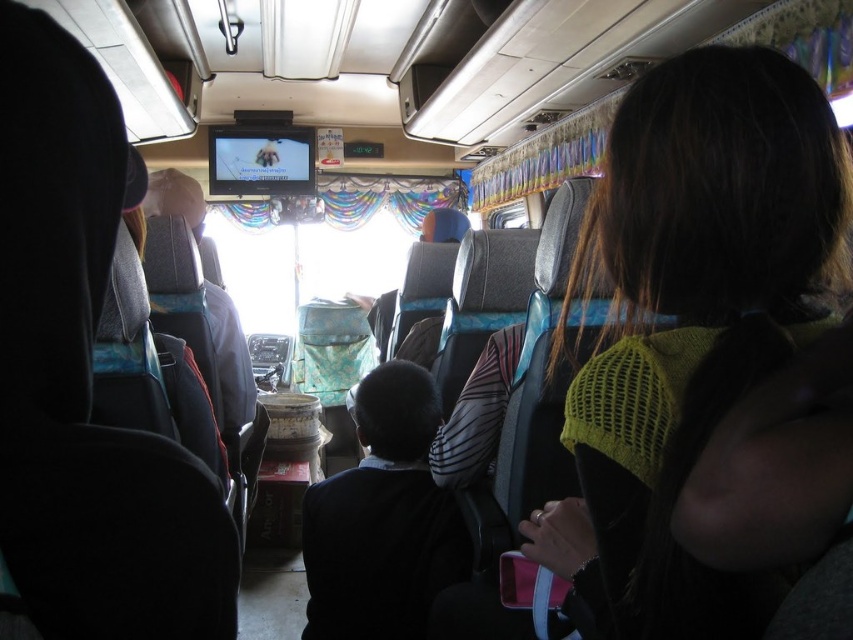
Does knitted yellow sweater at right lie behind dark blue fabric at center?

No, it is in front of dark blue fabric at center.

Describe the element at coordinates (689, 324) in the screenshot. I see `knitted yellow sweater at right` at that location.

The width and height of the screenshot is (853, 640). What do you see at coordinates (689, 324) in the screenshot?
I see `knitted yellow sweater at right` at bounding box center [689, 324].

Where is `knitted yellow sweater at right`? knitted yellow sweater at right is located at coordinates (689, 324).